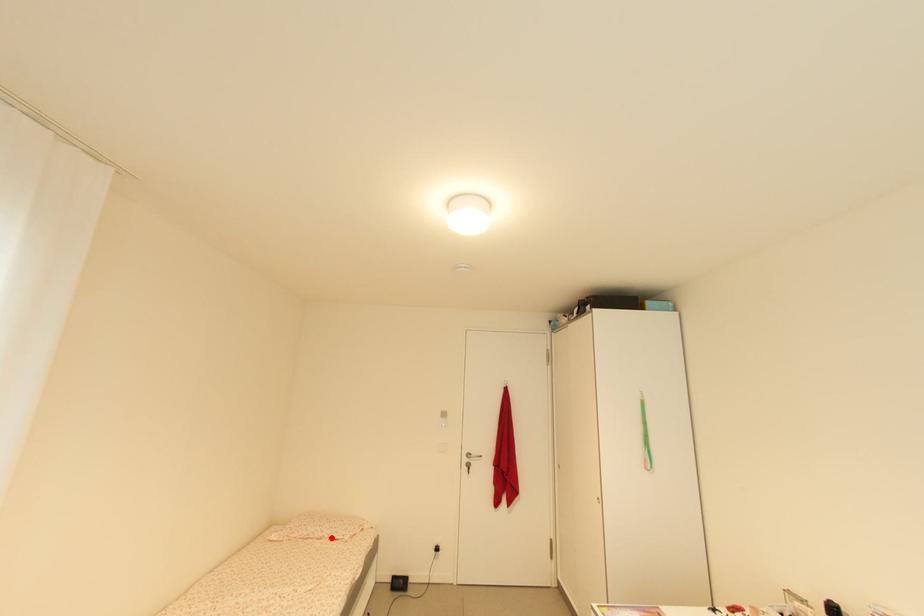
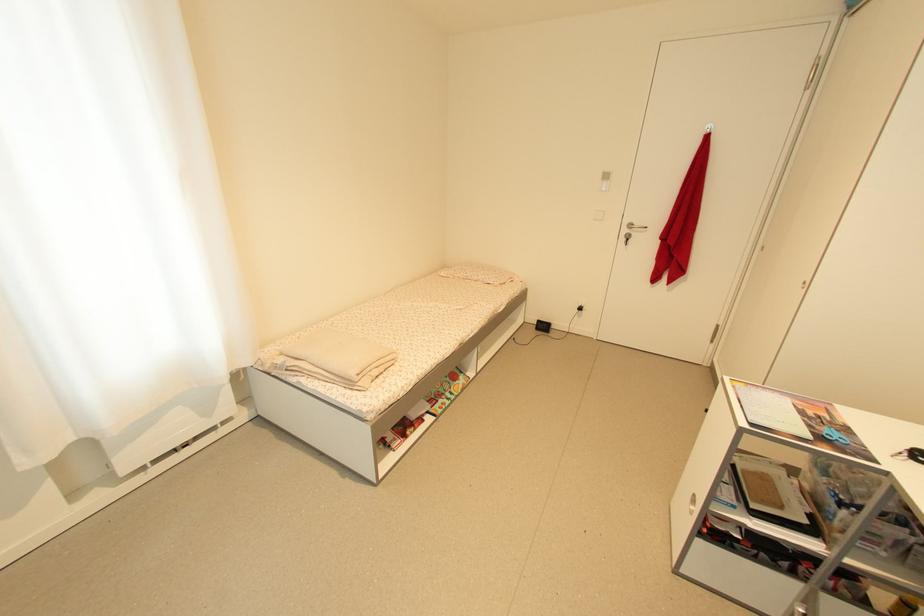
Find the pixel in the second image that matches the highlighted location in the first image.

(485, 282)